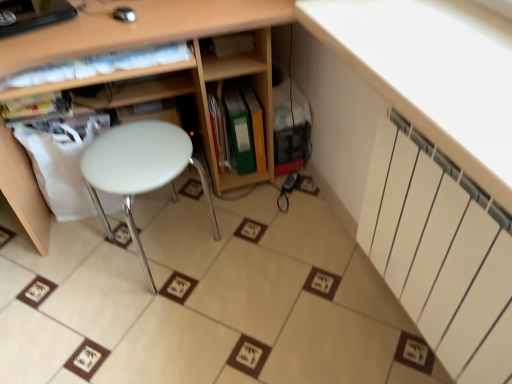
The image size is (512, 384). Identify the location of empty space that is in between white plastic stool at center and green matte folder at center, the third book from the left. (208, 208).